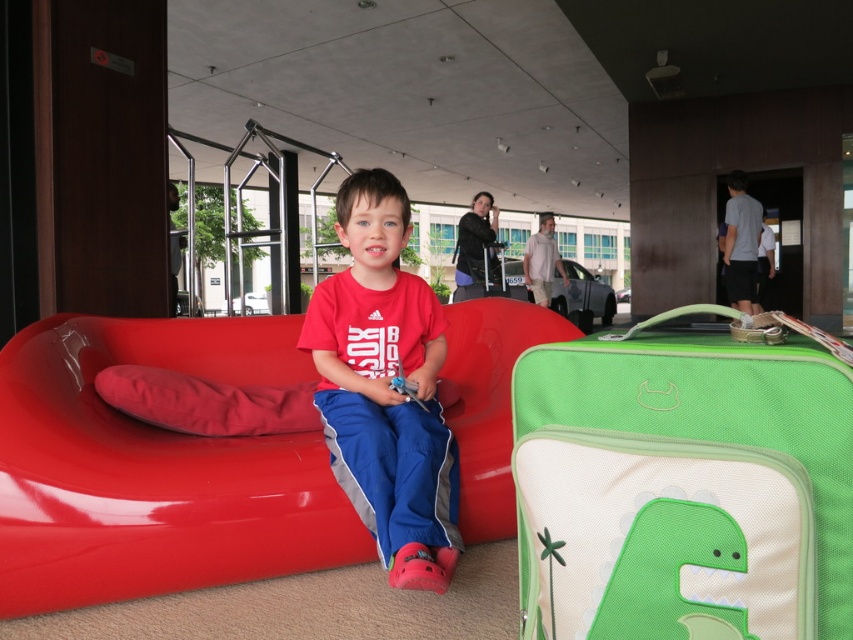
How distant is green fabric suitcase at center from matte red couch at center?

green fabric suitcase at center is 26.21 inches away from matte red couch at center.

Who is taller, green fabric suitcase at center or matte red couch at center?

matte red couch at center

Between point (698, 413) and point (424, 332), which one is positioned in front?

Point (698, 413) is more forward.

You are a GUI agent. You are given a task and a screenshot of the screen. Output one action in this format:
    pyautogui.click(x=<x>, y=<y>)
    Task: Click on the green fabric suitcase at center
    The image size is (853, 640).
    Given the screenshot: What is the action you would take?
    pyautogui.click(x=683, y=484)

Which is in front, point (316, 516) or point (450, 516)?

Positioned in front is point (316, 516).

Which of these two, matte plastic couch at center or matte red couch at center, stands shorter?

matte plastic couch at center is shorter.

Is point (485, 538) positioned in front of point (375, 435)?

No, it is behind (375, 435).

Where is `matte plastic couch at center`? The width and height of the screenshot is (853, 640). matte plastic couch at center is located at coordinates (154, 468).

Can you confirm if green fabric suitcase at center is taller than matte plastic couch at center?

Incorrect, green fabric suitcase at center's height is not larger of matte plastic couch at center's.

Does green fabric suitcase at center have a larger size compared to matte plastic couch at center?

Actually, green fabric suitcase at center might be smaller than matte plastic couch at center.

The width and height of the screenshot is (853, 640). What do you see at coordinates (683, 484) in the screenshot? I see `green fabric suitcase at center` at bounding box center [683, 484].

You are a GUI agent. You are given a task and a screenshot of the screen. Output one action in this format:
    pyautogui.click(x=<x>, y=<y>)
    Task: Click on the green fabric suitcase at center
    
    Given the screenshot: What is the action you would take?
    click(x=683, y=484)